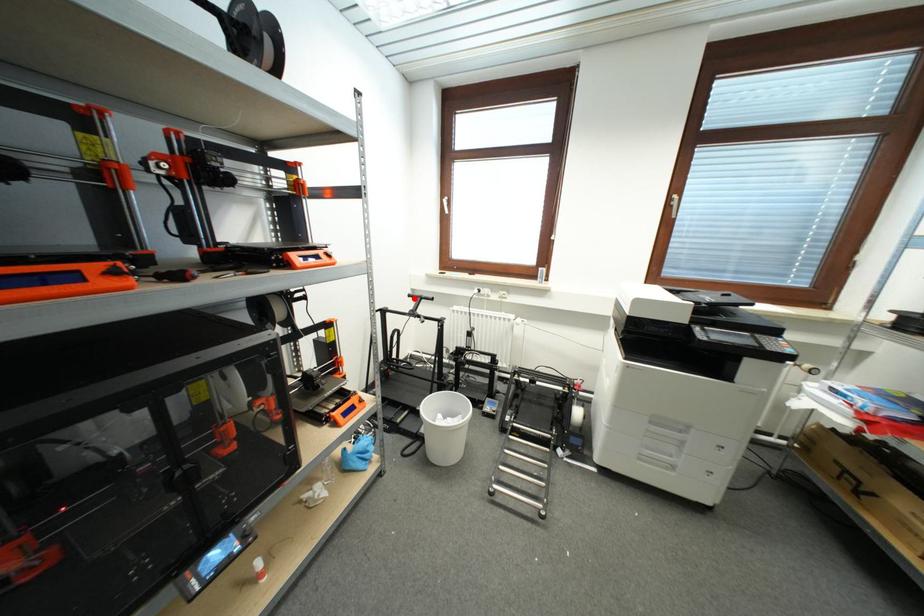
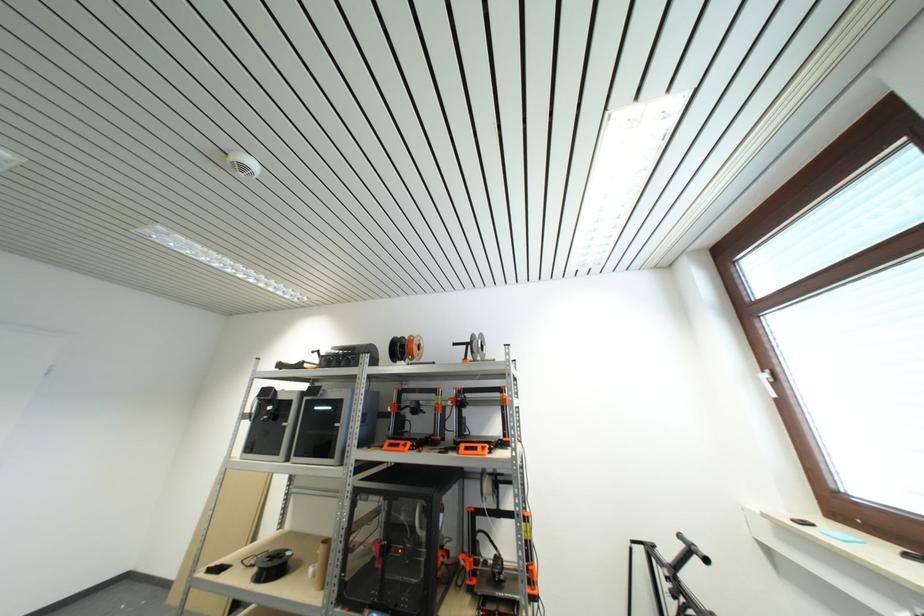
Where in the second image is the point corresponding to the highlighted location from the first image?

(685, 540)